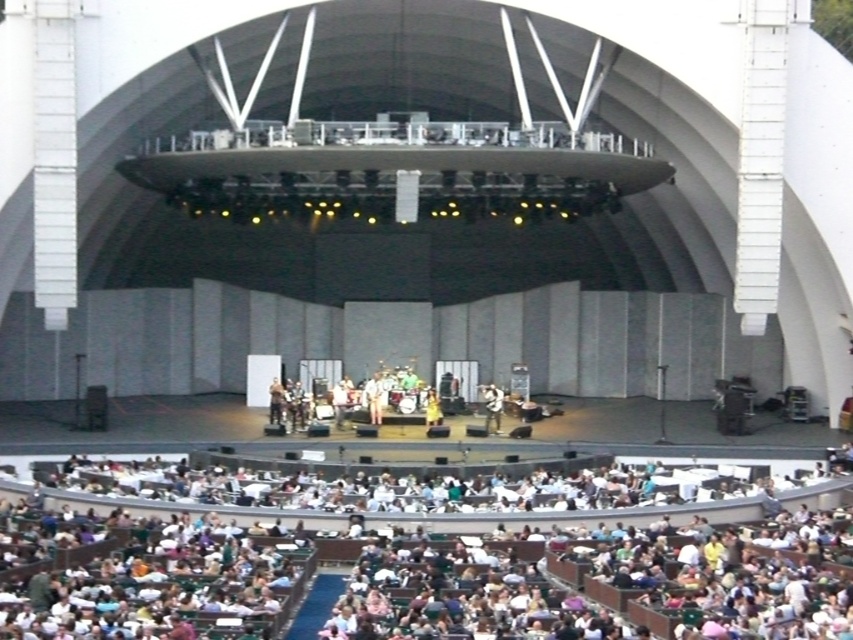
In the scene shown: You are a photographer at the concert venue and want to capture a clear shot of both the white fabric dress at center and the white fabric shirt at center. Since you have a camera with a fixed focal length, you need to ensure both are fully visible. Which object might require you to adjust your camera angle to avoid being cut off?

The white fabric dress at center might be wider than the white fabric shirt at center, so you might need to adjust your camera angle to ensure the dress is fully visible.

You are a photographer positioned at the back of the amphitheater. You want to take a photo that includes both the white fabric shirt at center and the white fabric dress at center stage. Given that your camera has a maximum focus range of 20 feet, will you be able to capture both subjects clearly in the same frame?

The distance between the white fabric shirt at center and the white fabric dress at center stage is 18.12 feet, which is within the camera maximum focus range of 20 feet. Therefore, you can capture both subjects clearly in the same frame.